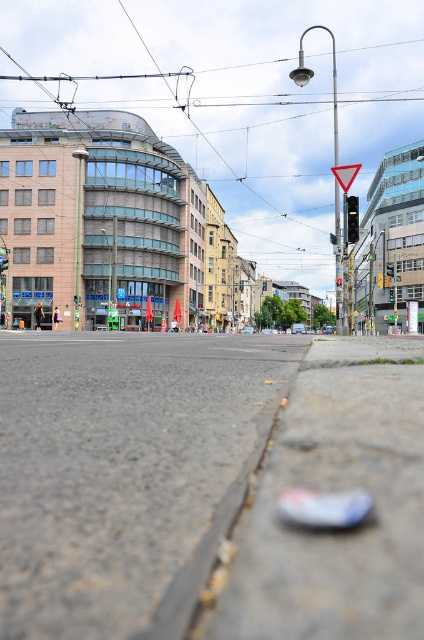
Question: From the image, what is the correct spatial relationship of gray asphalt pavement at lower center in relation to black plastic traffic light at upper center?

Choices:
 (A) below
 (B) above

Answer: (A)

Question: Among these points, which one is nearest to the camera?

Choices:
 (A) (345, 227)
 (B) (340, 276)

Answer: (A)

Question: Which object is the closest to the black plastic traffic light at upper center?

Choices:
 (A) black glass traffic light at center
 (B) gray asphalt pavement at lower center

Answer: (A)

Question: Is black glass traffic light at center to the left of black plastic traffic light at upper center from the viewer's perspective?

Choices:
 (A) yes
 (B) no

Answer: (B)

Question: Is black glass traffic light at center below black plastic traffic light at upper center?

Choices:
 (A) no
 (B) yes

Answer: (A)

Question: Which is nearer to the black glass traffic light at center?

Choices:
 (A) gray asphalt pavement at lower center
 (B) black plastic traffic light at upper center

Answer: (B)